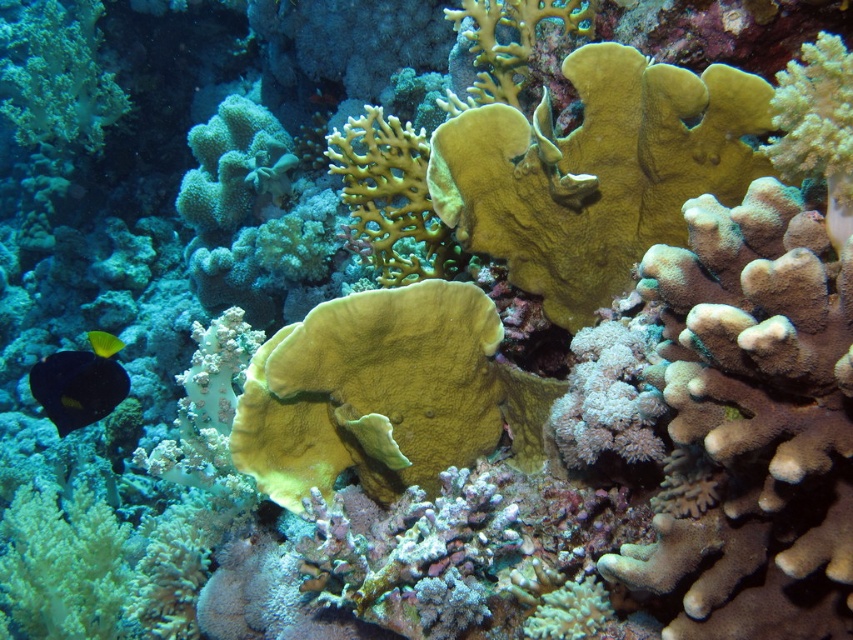
You are a marine biologist studying the underwater scene. You notice a shiny black fish at lower left. Can you determine its exact coordinates in the image?

The shiny black fish at lower left is located at point (80, 381).

You are a marine biologist observing an underwater scene with a shiny black fish at lower left and a shiny yellow fish at lower left. Which fish is bigger?

The shiny black fish at lower left is larger in size compared to the shiny yellow fish at lower left.

You are a marine biologist observing the underwater scene. You notice two fish at the lower left corner of the image. Which fish is taller between the shiny black fish at lower left and the shiny yellow fish at lower left?

The shiny black fish at lower left is much taller than the shiny yellow fish at lower left.